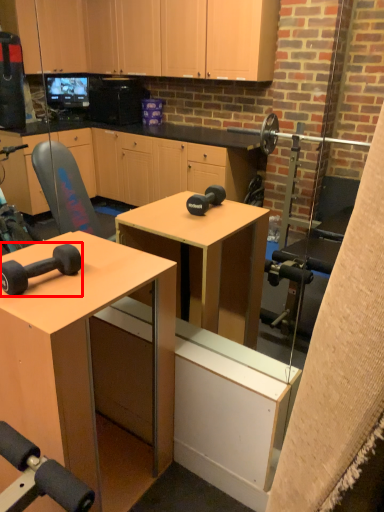
Question: From the image, what is the correct spatial relationship of dumbbell (annotated by the red box) in relation to desk?

Choices:
 (A) left
 (B) right

Answer: (B)